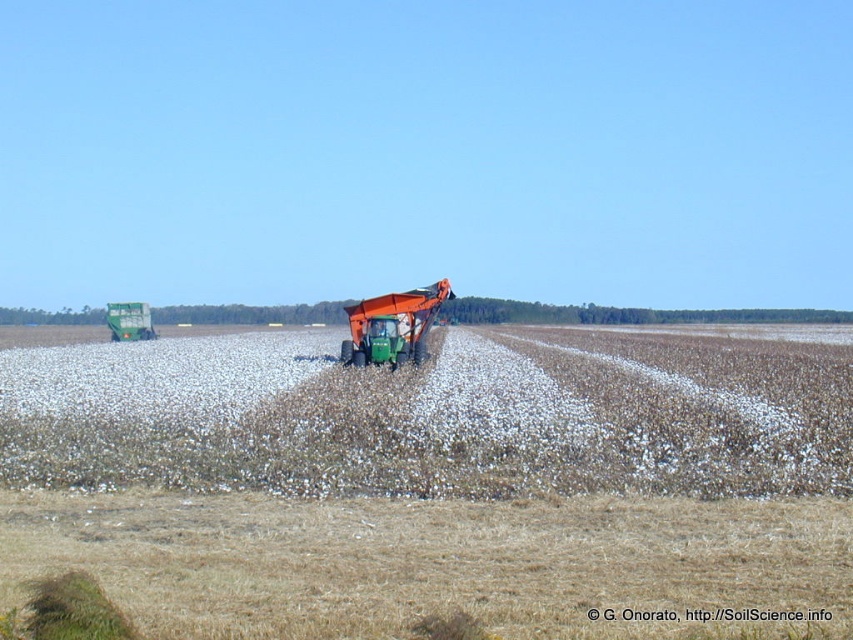
Question: Can you confirm if green plastic tractor at center is positioned above green matte tractor at center?

Choices:
 (A) yes
 (B) no

Answer: (B)

Question: From the image, what is the correct spatial relationship of white fluffy cotton at center in relation to green matte tractor at center?

Choices:
 (A) right
 (B) left

Answer: (A)

Question: Is white fluffy cotton at center bigger than green matte tractor at center?

Choices:
 (A) no
 (B) yes

Answer: (A)

Question: Which object is positioned farthest from the green matte tractor at center?

Choices:
 (A) green plastic tractor at center
 (B) white fluffy cotton at center

Answer: (A)

Question: Which is nearer to the white fluffy cotton at center?

Choices:
 (A) green matte tractor at center
 (B) green plastic tractor at center

Answer: (B)

Question: Which is nearer to the green plastic tractor at center?

Choices:
 (A) white fluffy cotton at center
 (B) green matte tractor at center

Answer: (A)